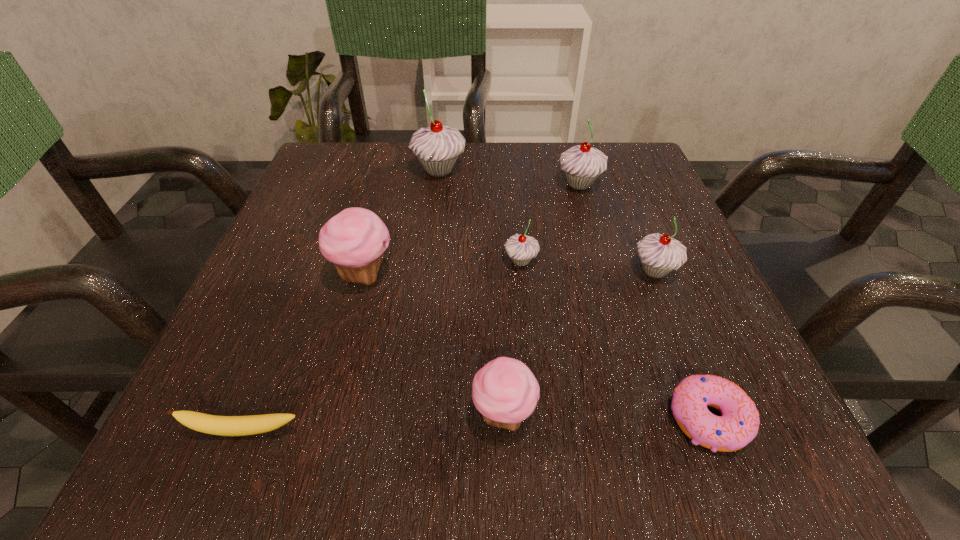
In order to click on cupcake that is at the near edge in this screenshot , I will do `click(505, 391)`.

This screenshot has width=960, height=540. Identify the location of banana located at the near edge. (211, 424).

You are a GUI agent. You are given a task and a screenshot of the screen. Output one action in this format:
    pyautogui.click(x=<x>, y=<y>)
    Task: Click on the doughnut at the near edge
    This screenshot has height=540, width=960.
    Given the screenshot: What is the action you would take?
    pyautogui.click(x=738, y=426)

Where is `cupcake that is at the left edge`? This screenshot has width=960, height=540. cupcake that is at the left edge is located at coordinates (355, 239).

You are a GUI agent. You are given a task and a screenshot of the screen. Output one action in this format:
    pyautogui.click(x=<x>, y=<y>)
    Task: Click on the banana present at the left edge
    
    Given the screenshot: What is the action you would take?
    pyautogui.click(x=211, y=424)

Locate an element on the screen. Image resolution: width=960 pixels, height=540 pixels. doughnut that is at the right edge is located at coordinates (738, 426).

Image resolution: width=960 pixels, height=540 pixels. I want to click on object that is positioned at the near left corner, so click(x=211, y=424).

The width and height of the screenshot is (960, 540). I want to click on object situated at the far right corner, so click(x=581, y=164).

At what (x,y) coordinates should I click in order to perform the action: click on object present at the near right corner. Please return your answer as a coordinate pair (x, y). Image resolution: width=960 pixels, height=540 pixels. Looking at the image, I should click on (738, 426).

The width and height of the screenshot is (960, 540). In the image, there is a desktop. Find the location of `vacant space at the near edge`. vacant space at the near edge is located at coordinates (448, 463).